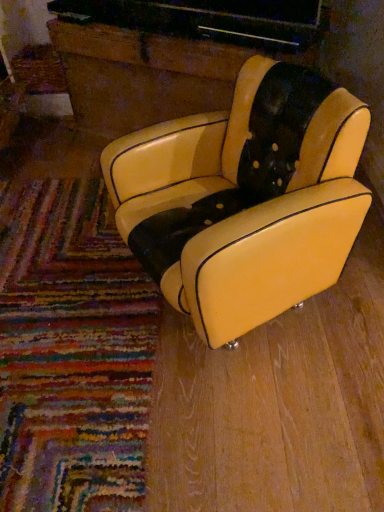
In order to face yellow leather chair at center, should I rotate leftwards or rightwards?

You should rotate right by 4.284 degrees.

The image size is (384, 512). What do you see at coordinates (245, 198) in the screenshot?
I see `yellow leather chair at center` at bounding box center [245, 198].

In order to click on yellow leather chair at center in this screenshot , I will do `click(245, 198)`.

Where is `yellow leather chair at center`? This screenshot has height=512, width=384. yellow leather chair at center is located at coordinates (245, 198).